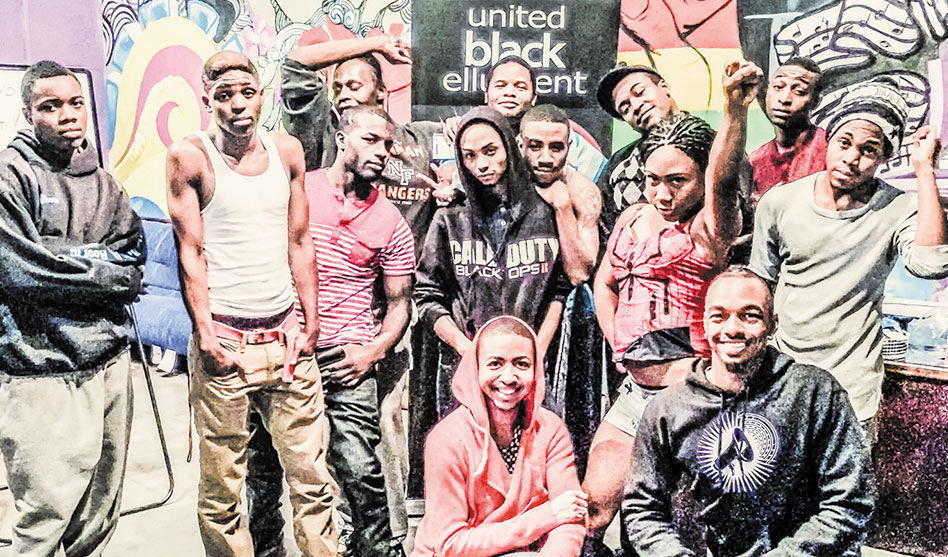
Image resolution: width=948 pixels, height=557 pixels. Identify the location of hood. (461, 388).